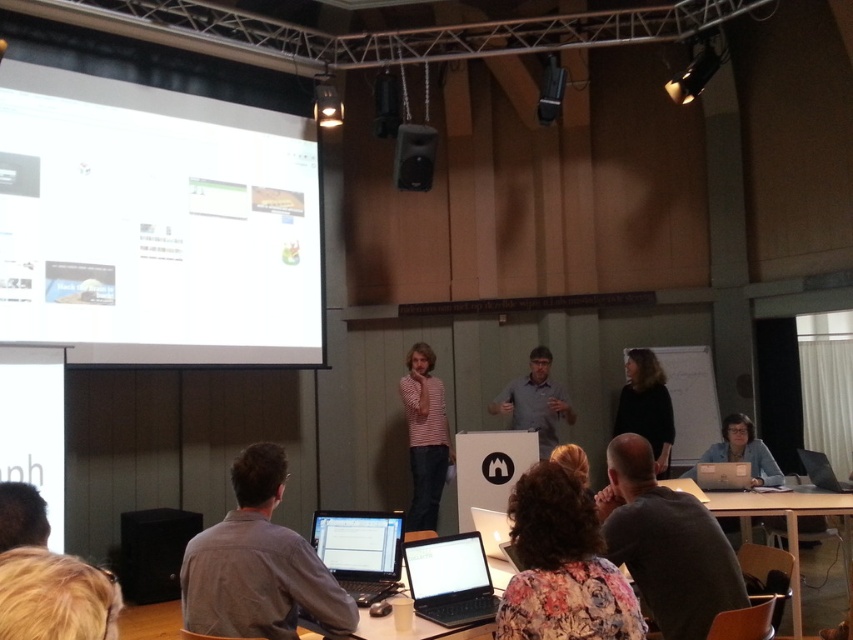
You are attending a conference and want to approach the speaker who is wearing a dark gray shirt at lower center. There is also a person in a black matte shirt at upper right. Which speaker should you approach first to ask a question?

You should approach the dark gray shirt at lower center first because it is closer to you than the black matte shirt at upper right.

You are attending a conference and see two presenters in the room. One is wearing a dark gray shirt at lower center and the other is wearing a black matte shirt at upper right. Which presenter is positioned to the left of the other?

The dark gray shirt at lower center is positioned to the left of the black matte shirt at upper right.